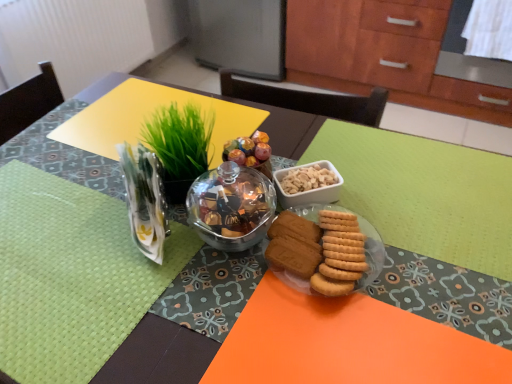
Find the location of a particular element. This screenshot has height=384, width=512. clear plastic vase at upper left is located at coordinates (144, 199).

You are a GUI agent. You are given a task and a screenshot of the screen. Output one action in this format:
    pyautogui.click(x=<x>, y=<y>)
    Task: Click on the matte glass bowl at center
    This screenshot has width=512, height=384.
    Given the screenshot: What is the action you would take?
    pyautogui.click(x=371, y=254)

This screenshot has height=384, width=512. What do you see at coordinates (361, 231) in the screenshot?
I see `matte glass plate at center` at bounding box center [361, 231].

Locate an element on the screen. golden matte cookies at center is located at coordinates (294, 245).

The width and height of the screenshot is (512, 384). Identify the location of clear plastic vase at upper left. (144, 199).

Would you say green woven placemat at left is outside golden matte cookies at center?

Absolutely, green woven placemat at left is external to golden matte cookies at center.

Is green woven placemat at left wider than golden matte cookies at center?

Yes.

Between golden matte cookies at center and clear plastic vase at upper left, which one has smaller size?

Smaller between the two is golden matte cookies at center.

Do you think golden matte cookies at center is within clear plastic vase at upper left, or outside of it?

golden matte cookies at center is not inside clear plastic vase at upper left, it's outside.

Which is nearer, [310,267] or [129,166]?

Point [310,267] is positioned closer to the camera compared to point [129,166].

Image resolution: width=512 pixels, height=384 pixels. Find the location of `tableware that appears in front of the golden matte cookies at center`. tableware that appears in front of the golden matte cookies at center is located at coordinates (144, 199).

Which is less distant, (x=140, y=159) or (x=184, y=156)?

Point (x=140, y=159) appears to be closer to the viewer than point (x=184, y=156).

Locate an element on the screen. The height and width of the screenshot is (384, 512). grass that is on the right side of clear plastic vase at upper left is located at coordinates (180, 140).

From a real-world perspective, which is physically above, clear plastic vase at upper left or green leafy grass at upper center?

green leafy grass at upper center.

Is matte glass plate at center surrounding clear plastic vase at upper left?

Actually, clear plastic vase at upper left is outside matte glass plate at center.

Could you tell me if matte glass plate at center is turned towards clear plastic vase at upper left?

No, matte glass plate at center is not turned towards clear plastic vase at upper left.

Is point (306, 216) farther from camera compared to point (149, 179)?

Yes, it is behind point (149, 179).

Consider the image. Looking at their sizes, would you say matte glass plate at center is wider or thinner than clear plastic vase at upper left?

matte glass plate at center is wider than clear plastic vase at upper left.

How many degrees apart are the facing directions of green leafy grass at upper center and matte glass bowl at center?

The angle between the facing direction of green leafy grass at upper center and the facing direction of matte glass bowl at center is 159 degrees.

From the image's perspective, which is above, green leafy grass at upper center or matte glass bowl at center?

green leafy grass at upper center, from the image's perspective.

From a real-world perspective, is green leafy grass at upper center over matte glass bowl at center?

Correct, in the physical world, green leafy grass at upper center is higher than matte glass bowl at center.

Considering the positions of objects green leafy grass at upper center and matte glass bowl at center in the image provided, who is behind, green leafy grass at upper center or matte glass bowl at center?

matte glass bowl at center is further away from the camera.

Considering the relative sizes of clear plastic vase at upper left and matte glass plate at center in the image provided, is clear plastic vase at upper left thinner than matte glass plate at center?

Yes, clear plastic vase at upper left is thinner than matte glass plate at center.

From the image's perspective, is clear plastic vase at upper left located above matte glass plate at center?

Yes, from the image's perspective, clear plastic vase at upper left is over matte glass plate at center.

Can you confirm if clear plastic vase at upper left is taller than matte glass plate at center?

Correct, clear plastic vase at upper left is much taller as matte glass plate at center.

Considering the relative sizes of clear plastic vase at upper left and matte glass plate at center in the image provided, is clear plastic vase at upper left bigger than matte glass plate at center?

Correct, clear plastic vase at upper left is larger in size than matte glass plate at center.

Considering the relative sizes of green woven placemat at left and matte glass bowl at center in the image provided, is green woven placemat at left thinner than matte glass bowl at center?

Indeed, green woven placemat at left has a lesser width compared to matte glass bowl at center.

Which is correct: green woven placemat at left is inside matte glass bowl at center, or outside of it?

The correct answer is: outside.

In order to click on place mat lying below the golden matte cookies at center (from the image's perspective) in this screenshot , I will do `click(71, 276)`.

This screenshot has height=384, width=512. There is a golden matte cookies at center. Find the location of `tableware above it (from a real-world perspective)`. tableware above it (from a real-world perspective) is located at coordinates (144, 199).

Which object lies nearer to the anchor point green woven placemat at left, matte glass plate at center or golden matte cookies at center?

golden matte cookies at center.

Based on their spatial positions, is green leafy grass at upper center or clear plastic vase at upper left further from matte glass bowl at center?

green leafy grass at upper center.

Based on their spatial positions, is matte glass bowl at center or matte glass plate at center closer to clear plastic vase at upper left?

matte glass bowl at center is closer to clear plastic vase at upper left.

Considering their positions, is matte glass bowl at center positioned closer to clear plastic vase at upper left than green leafy grass at upper center?

green leafy grass at upper center is closer to clear plastic vase at upper left.

Estimate the real-world distances between objects in this image. Which object is further from green woven placemat at left, green leafy grass at upper center or clear plastic vase at upper left?

Based on the image, green leafy grass at upper center appears to be further to green woven placemat at left.

Looking at the image, which one is located further to matte glass plate at center, golden matte cookies at center or green woven placemat at left?

Based on the image, green woven placemat at left appears to be further to matte glass plate at center.

Looking at the image, which one is located further to green leafy grass at upper center, clear plastic vase at upper left or matte glass bowl at center?

The object further to green leafy grass at upper center is matte glass bowl at center.

Based on the photo, estimate the real-world distances between objects in this image. Which object is further from golden matte cookies at center, matte glass bowl at center or clear plastic vase at upper left?

Among the two, clear plastic vase at upper left is located further to golden matte cookies at center.

You are a GUI agent. You are given a task and a screenshot of the screen. Output one action in this format:
    pyautogui.click(x=<x>, y=<y>)
    Task: Click on the meal situated between clear plastic vase at upper left and matte glass plate at center from left to right
    Image resolution: width=512 pixels, height=384 pixels.
    Given the screenshot: What is the action you would take?
    [371, 254]

Locate an element on the screen. Image resolution: width=512 pixels, height=384 pixels. meal situated between green woven placemat at left and golden matte cookies at center from left to right is located at coordinates (371, 254).

I want to click on meal between green leafy grass at upper center and matte glass plate at center in the horizontal direction, so click(371, 254).

Identify the location of snack between clear plastic vase at upper left and matte glass plate at center in the horizontal direction. Image resolution: width=512 pixels, height=384 pixels. (294, 245).